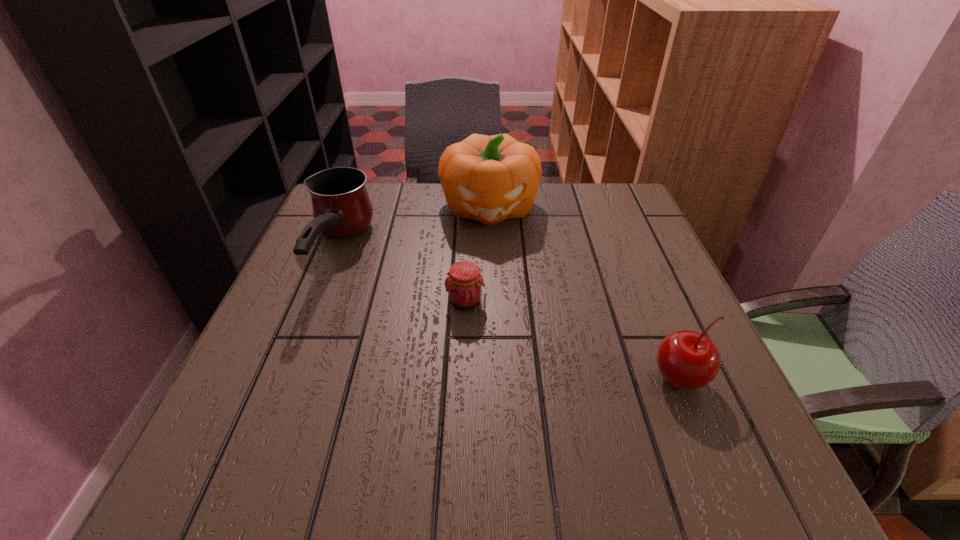
The height and width of the screenshot is (540, 960). Identify the location of vacant point located between the shortest object and the leftmost object. pyautogui.click(x=400, y=277).

Image resolution: width=960 pixels, height=540 pixels. In order to click on empty space between the rightmost object and the tallest object in this screenshot , I will do `click(585, 293)`.

Find the location of a particular element. empty location between the leftmost object and the jam is located at coordinates (400, 277).

At what (x,y) coordinates should I click in order to perform the action: click on empty space that is in between the third shortest object and the jam. Please return your answer as a coordinate pair (x, y). The image size is (960, 540). Looking at the image, I should click on (400, 277).

Locate an element on the screen. empty space that is in between the shortest object and the nearest object is located at coordinates (573, 340).

Locate an element on the screen. This screenshot has height=540, width=960. vacant area that lies between the jam and the leftmost object is located at coordinates (400, 277).

The width and height of the screenshot is (960, 540). In order to click on free spot between the cherry and the saucepan in this screenshot , I will do `click(508, 316)`.

Where is `vacant space that's between the nearest object and the leftmost object`? The image size is (960, 540). vacant space that's between the nearest object and the leftmost object is located at coordinates (508, 316).

At what (x,y) coordinates should I click in order to perform the action: click on free spot between the saucepan and the tallest object. Please return your answer as a coordinate pair (x, y). The image size is (960, 540). Looking at the image, I should click on [x=413, y=230].

Where is `free space between the jam and the leftmost object`? The width and height of the screenshot is (960, 540). free space between the jam and the leftmost object is located at coordinates (400, 277).